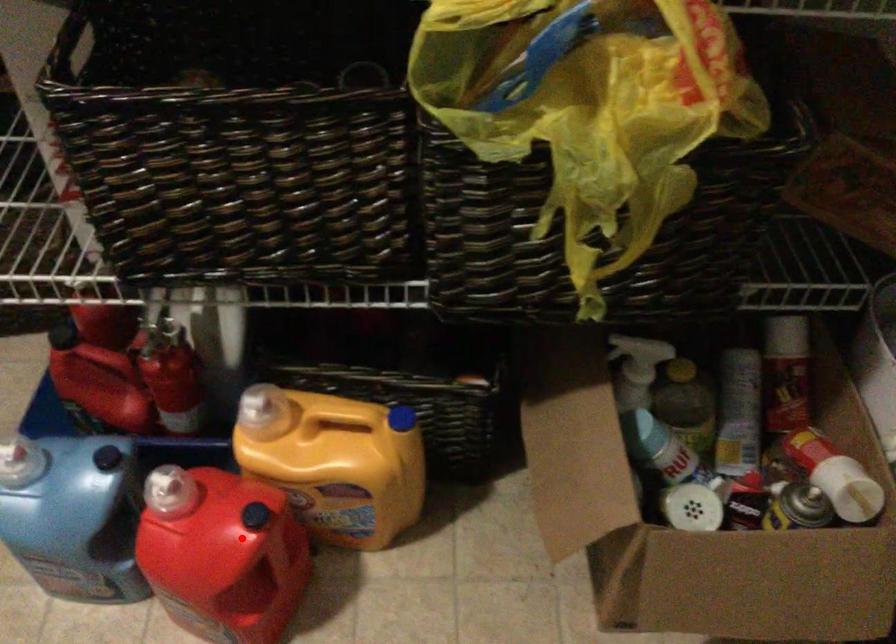
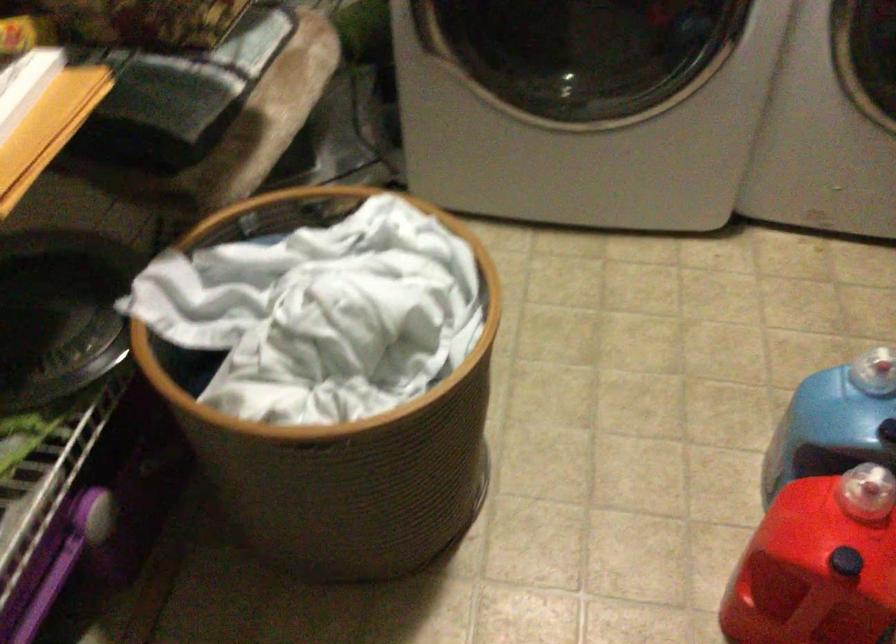
In the second image, find the point that corresponds to the highlighted location in the first image.

(814, 571)